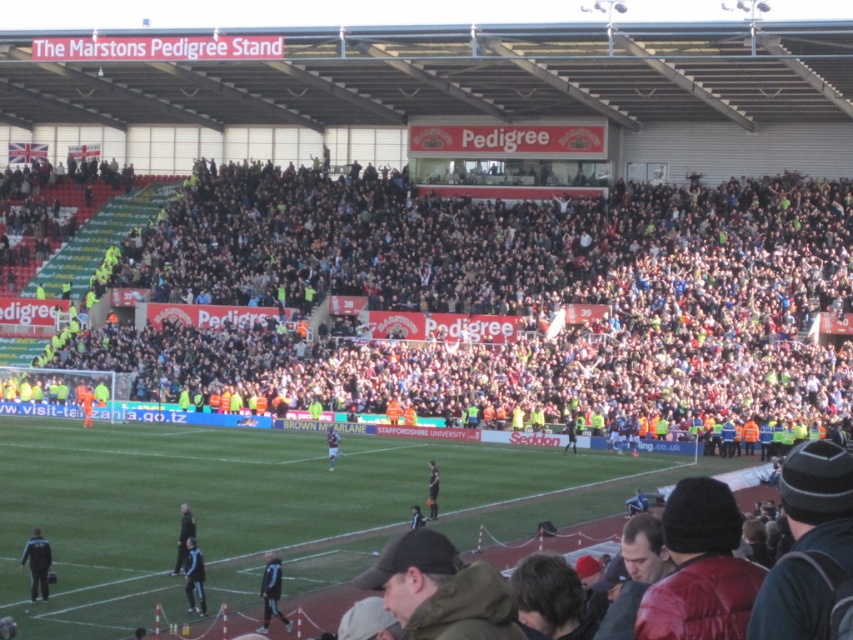
Question: Which point is farther to the camera?

Choices:
 (A) (720, 356)
 (B) (39, 564)
 (C) (265, 618)
 (D) (332, 444)

Answer: (A)

Question: Which of these objects is positioned farthest from the dark blue jacket at lower left?

Choices:
 (A) light brown leather jacket at center
 (B) dark gray jacket at center

Answer: (A)

Question: Does dark blue jacket at lower left appear on the right side of dark blue jersey at center?

Choices:
 (A) no
 (B) yes

Answer: (A)

Question: Is dark blue jacket at lower left above dark blue jersey at center?

Choices:
 (A) yes
 (B) no

Answer: (A)

Question: Is dark gray jacket at lower center thinner than light brown leather jacket at center?

Choices:
 (A) no
 (B) yes

Answer: (A)

Question: Considering the real-world distances, which object is farthest from the dark gray crowd at center?

Choices:
 (A) dark blue jersey at center
 (B) blue fabric jacket at lower left
 (C) dark blue jacket at lower left

Answer: (A)